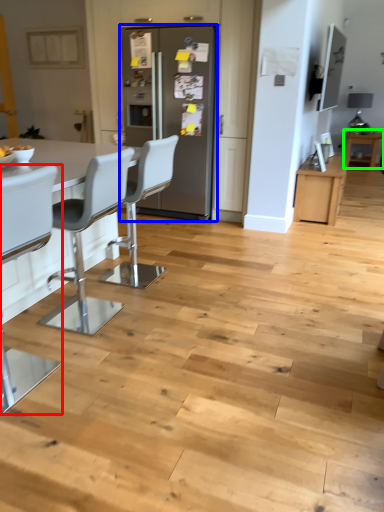
Question: Which is nearer to the chair (highlighted by a red box)? fridge (highlighted by a blue box) or table (highlighted by a green box).

Choices:
 (A) fridge
 (B) table

Answer: (A)